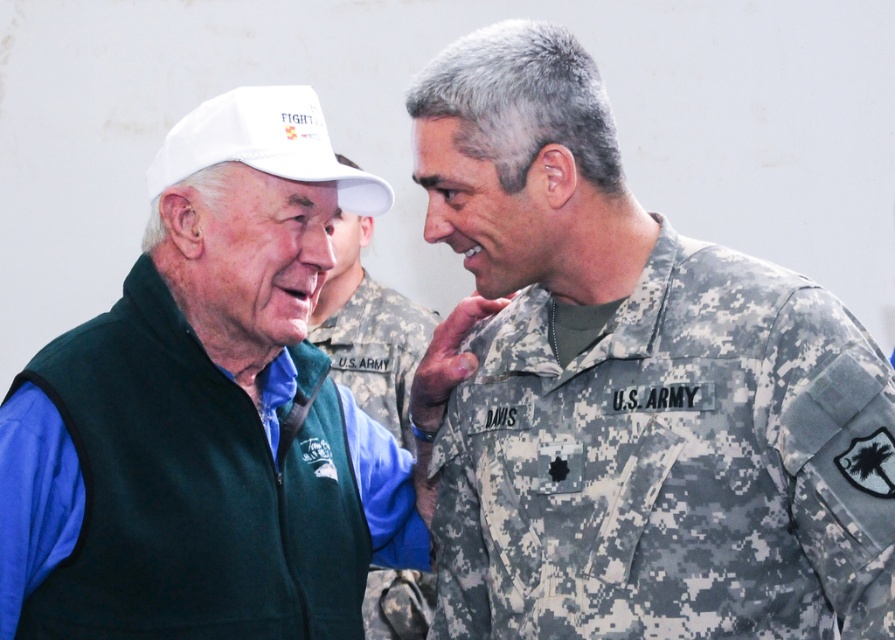
Does camouflage fabric us army uniform at center appear over white matte baseball cap at upper left?

Correct, camouflage fabric us army uniform at center is located above white matte baseball cap at upper left.

Who is shorter, camouflage fabric us army uniform at center or white matte baseball cap at upper left?

Standing shorter between the two is camouflage fabric us army uniform at center.

Which is in front, point (788, 420) or point (416, 314)?

Positioned in front is point (788, 420).

Identify the location of camouflage fabric us army uniform at center. (635, 390).

Who is higher up, green fleece vest at left or white matte baseball cap at upper left?

white matte baseball cap at upper left is above.

What do you see at coordinates (189, 490) in the screenshot? Image resolution: width=895 pixels, height=640 pixels. I see `green fleece vest at left` at bounding box center [189, 490].

Is point (172, 468) positioned in front of point (396, 401)?

Yes.

This screenshot has height=640, width=895. I want to click on green fleece vest at left, so tap(189, 490).

Is camouflage fabric us army uniform at center positioned behind green fleece vest at left?

No, it is not.

Is camouflage fabric us army uniform at center closer to camera compared to green fleece vest at left?

Yes, it is.

Who is more forward, (x=527, y=493) or (x=11, y=525)?

Point (x=11, y=525)

Locate an element on the screen. Image resolution: width=895 pixels, height=640 pixels. camouflage fabric us army uniform at center is located at coordinates (635, 390).